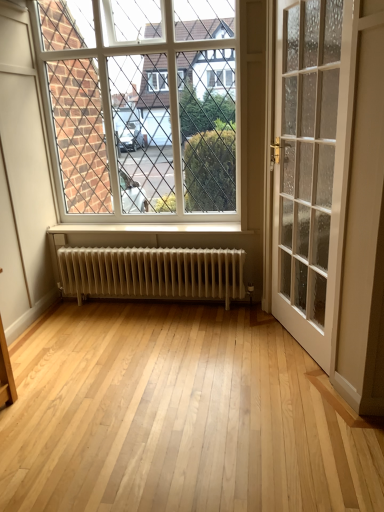
In order to click on vacant region above white metallic radiator at center (from a real-world perspective) in this screenshot , I will do `click(127, 249)`.